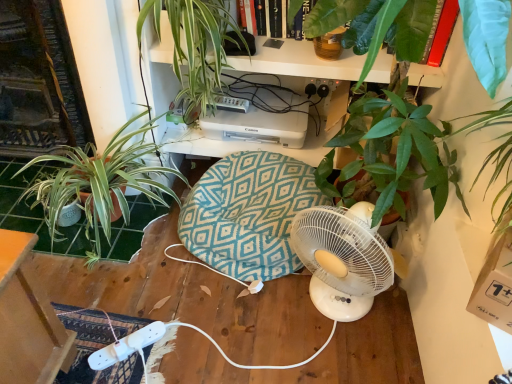
Question: From the image's perspective, is black plastic plug at upper center above teal fabric swivel chair at center?

Choices:
 (A) yes
 (B) no

Answer: (A)

Question: Does black plastic plug at upper center have a larger size compared to teal fabric swivel chair at center?

Choices:
 (A) no
 (B) yes

Answer: (A)

Question: From a real-world perspective, is black plastic plug at upper center below teal fabric swivel chair at center?

Choices:
 (A) yes
 (B) no

Answer: (B)

Question: From the image's perspective, is black plastic plug at upper center located beneath teal fabric swivel chair at center?

Choices:
 (A) yes
 (B) no

Answer: (B)

Question: Considering the relative sizes of black plastic plug at upper center and teal fabric swivel chair at center in the image provided, is black plastic plug at upper center wider than teal fabric swivel chair at center?

Choices:
 (A) yes
 (B) no

Answer: (B)

Question: Considering the positions of black plastic plug at upper center and green leafy plant at left, the first houseplant when ordered from left to right, in the image, is black plastic plug at upper center taller or shorter than green leafy plant at left, the first houseplant when ordered from left to right,?

Choices:
 (A) tall
 (B) short

Answer: (B)

Question: From a real-world perspective, is black plastic plug at upper center physically located above or below green leafy plant at left, the 2th houseplant viewed from the right?

Choices:
 (A) below
 (B) above

Answer: (B)

Question: Considering the relative positions of black plastic plug at upper center and green leafy plant at left, the 2th houseplant viewed from the right, in the image provided, is black plastic plug at upper center to the left or to the right of green leafy plant at left, the 2th houseplant viewed from the right,?

Choices:
 (A) right
 (B) left

Answer: (A)

Question: Is point (309, 86) closer or farther from the camera than point (114, 140)?

Choices:
 (A) farther
 (B) closer

Answer: (A)

Question: Is green leafy plant at upper center, the 1th houseplant from the right, wider or thinner than black plastic plug at upper center?

Choices:
 (A) thin
 (B) wide

Answer: (B)

Question: From the image's perspective, is green leafy plant at upper center, the 2th houseplant from the left, positioned above or below black plastic plug at upper center?

Choices:
 (A) below
 (B) above

Answer: (B)

Question: Looking at the image, does green leafy plant at upper center, the 1th houseplant from the right, seem bigger or smaller compared to black plastic plug at upper center?

Choices:
 (A) small
 (B) big

Answer: (B)

Question: Based on their positions, is green leafy plant at upper center, the 1th houseplant from the right, located to the left or right of black plastic plug at upper center?

Choices:
 (A) right
 (B) left

Answer: (B)

Question: Is green leafy plant at left, the first houseplant when ordered from left to right, inside or outside of green leafy plant at upper center, the 1th houseplant from the right?

Choices:
 (A) inside
 (B) outside

Answer: (B)

Question: Is green leafy plant at left, the 2th houseplant viewed from the right, in front of or behind green leafy plant at upper center, the 1th houseplant from the right, in the image?

Choices:
 (A) front
 (B) behind

Answer: (B)